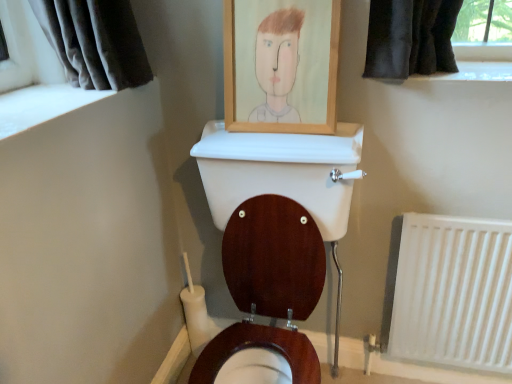
Where is `wooden picture frame at upper center`? wooden picture frame at upper center is located at coordinates (281, 65).

What do you see at coordinates (281, 65) in the screenshot? The height and width of the screenshot is (384, 512). I see `wooden picture frame at upper center` at bounding box center [281, 65].

The width and height of the screenshot is (512, 384). What do you see at coordinates (449, 292) in the screenshot? I see `white plastic radiator at lower right` at bounding box center [449, 292].

What is the approximate width of white plastic radiator at lower right?

white plastic radiator at lower right is 2.59 inches in width.

The image size is (512, 384). Find the location of `white plastic radiator at lower right`. white plastic radiator at lower right is located at coordinates (449, 292).

Measure the distance between white plastic radiator at lower right and camera.

1.27 meters.

Find the location of `wooden picture frame at upper center`. wooden picture frame at upper center is located at coordinates (281, 65).

Which is more to the right, white plastic radiator at lower right or wooden picture frame at upper center?

Positioned to the right is white plastic radiator at lower right.

Is white plastic radiator at lower right further to camera compared to wooden picture frame at upper center?

Yes, white plastic radiator at lower right is behind wooden picture frame at upper center.

Is point (413, 322) positioned after point (274, 108)?

That is True.

From the image's perspective, between white plastic radiator at lower right and wooden picture frame at upper center, who is located below?

white plastic radiator at lower right appears lower in the image.

From a real-world perspective, is white plastic radiator at lower right physically above wooden picture frame at upper center?

Actually, white plastic radiator at lower right is physically below wooden picture frame at upper center in the real world.

Which object is thinner, white plastic radiator at lower right or wooden picture frame at upper center?

white plastic radiator at lower right.

Who is shorter, white plastic radiator at lower right or wooden picture frame at upper center?

With less height is wooden picture frame at upper center.

Which of these two, white plastic radiator at lower right or wooden picture frame at upper center, is bigger?

Bigger between the two is white plastic radiator at lower right.

Is white plastic radiator at lower right not inside wooden picture frame at upper center?

Yes, white plastic radiator at lower right is located beyond the bounds of wooden picture frame at upper center.

Is white plastic radiator at lower right in contact with wooden picture frame at upper center?

No, white plastic radiator at lower right is not beside wooden picture frame at upper center.

Is white plastic radiator at lower right aimed at wooden picture frame at upper center?

Result: No.

How distant is white plastic radiator at lower right from wooden picture frame at upper center?

The distance of white plastic radiator at lower right from wooden picture frame at upper center is 66.73 centimeters.

In the image, there is a wooden picture frame at upper center. Identify the location of radiator below it (from the image's perspective). This screenshot has height=384, width=512. (449, 292).

Is wooden picture frame at upper center to the left of white plastic radiator at lower right from the viewer's perspective?

Yes.

Does wooden picture frame at upper center lie behind white plastic radiator at lower right?

No, it is not.

Considering the points (229, 26) and (419, 302), which point is behind, point (229, 26) or point (419, 302)?

The point (419, 302) is farther from the camera.

From the image's perspective, is wooden picture frame at upper center over white plastic radiator at lower right?

Yes, from the image's perspective, wooden picture frame at upper center is above white plastic radiator at lower right.

From a real-world perspective, is wooden picture frame at upper center positioned under white plastic radiator at lower right based on gravity?

Actually, wooden picture frame at upper center is physically above white plastic radiator at lower right in the real world.

Does wooden picture frame at upper center have a lesser width compared to white plastic radiator at lower right?

No, wooden picture frame at upper center is not thinner than white plastic radiator at lower right.

Is wooden picture frame at upper center taller or shorter than white plastic radiator at lower right?

In the image, wooden picture frame at upper center appears to be shorter than white plastic radiator at lower right.

Who is smaller, wooden picture frame at upper center or white plastic radiator at lower right?

wooden picture frame at upper center.

Is wooden picture frame at upper center outside of white plastic radiator at lower right?

Yes, wooden picture frame at upper center is outside of white plastic radiator at lower right.

Would you consider wooden picture frame at upper center to be distant from white plastic radiator at lower right?

wooden picture frame at upper center is near white plastic radiator at lower right, not far away.

Is wooden picture frame at upper center facing away from white plastic radiator at lower right?

No, white plastic radiator at lower right is not at the back of wooden picture frame at upper center.

What's the angular difference between wooden picture frame at upper center and white plastic radiator at lower right's facing directions?

0.483 degrees.

I want to click on picture frame in front of the white plastic radiator at lower right, so [281, 65].

Find the location of a particular element. picture frame lying in front of the white plastic radiator at lower right is located at coordinates (281, 65).

What are the coordinates of `radiator that is on the right side of wooden picture frame at upper center` in the screenshot? It's located at (449, 292).